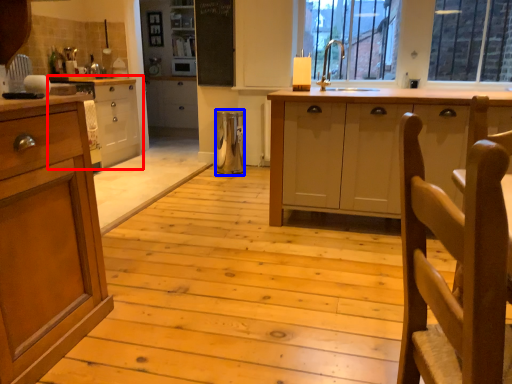
Question: Among these objects, which one is farthest to the camera, cabinetry (highlighted by a red box) or appliance (highlighted by a blue box)?

Choices:
 (A) cabinetry
 (B) appliance

Answer: (B)